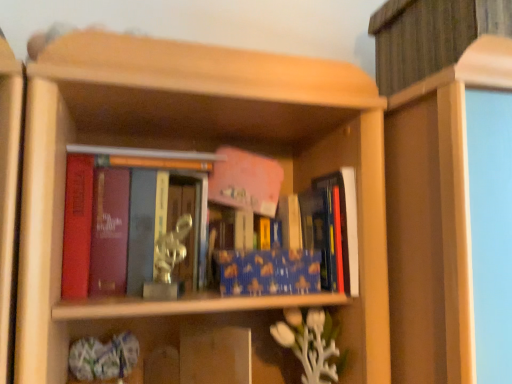
Question: Is blue glossy book at center, which ranks as the second book in left-to-right order, facing towards metallic statue at center, the second book when ordered from right to left?

Choices:
 (A) yes
 (B) no

Answer: (B)

Question: From a real-world perspective, is blue glossy book at center, which ranks as the second book in left-to-right order, under metallic statue at center, arranged as the 1th book when viewed from the left?

Choices:
 (A) yes
 (B) no

Answer: (A)

Question: Does blue glossy book at center, the first book when ordered from right to left, have a greater height compared to metallic statue at center, the second book when ordered from right to left?

Choices:
 (A) no
 (B) yes

Answer: (A)

Question: Can you confirm if blue glossy book at center, which ranks as the second book in left-to-right order, is shorter than metallic statue at center, arranged as the 1th book when viewed from the left?

Choices:
 (A) yes
 (B) no

Answer: (A)

Question: From a real-world perspective, is blue glossy book at center, which ranks as the second book in left-to-right order, on top of metallic statue at center, the second book when ordered from right to left?

Choices:
 (A) no
 (B) yes

Answer: (A)

Question: Can you confirm if blue glossy book at center, which ranks as the second book in left-to-right order, is thinner than metallic statue at center, the second book when ordered from right to left?

Choices:
 (A) no
 (B) yes

Answer: (B)

Question: Is metallic silver statue at center with metallic statue at center, the second book when ordered from right to left?

Choices:
 (A) yes
 (B) no

Answer: (B)

Question: Are metallic silver statue at center and metallic statue at center, the second book when ordered from right to left, far apart?

Choices:
 (A) no
 (B) yes

Answer: (A)

Question: Can you confirm if metallic silver statue at center is positioned to the right of metallic statue at center, the second book when ordered from right to left?

Choices:
 (A) yes
 (B) no

Answer: (A)

Question: Is metallic silver statue at center smaller than metallic statue at center, the second book when ordered from right to left?

Choices:
 (A) no
 (B) yes

Answer: (B)

Question: Is metallic statue at center, the second book when ordered from right to left, located within metallic silver statue at center?

Choices:
 (A) no
 (B) yes

Answer: (A)

Question: Considering the relative sizes of metallic silver statue at center and metallic statue at center, arranged as the 1th book when viewed from the left, in the image provided, is metallic silver statue at center wider than metallic statue at center, arranged as the 1th book when viewed from the left,?

Choices:
 (A) no
 (B) yes

Answer: (A)

Question: Does metallic statue at center, arranged as the 1th book when viewed from the left, touch blue glossy book at center, the first book when ordered from right to left?

Choices:
 (A) yes
 (B) no

Answer: (B)